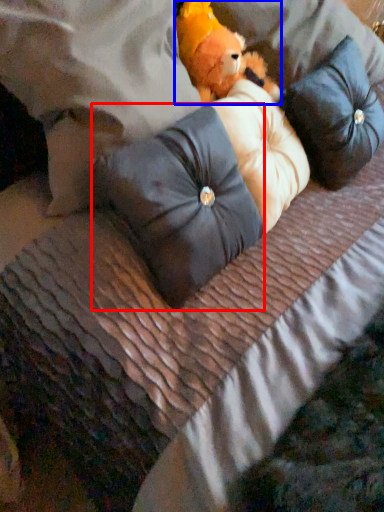
Question: Which point is further to the camera, pillow (highlighted by a red box) or teddy bear (highlighted by a blue box)?

Choices:
 (A) pillow
 (B) teddy bear

Answer: (B)